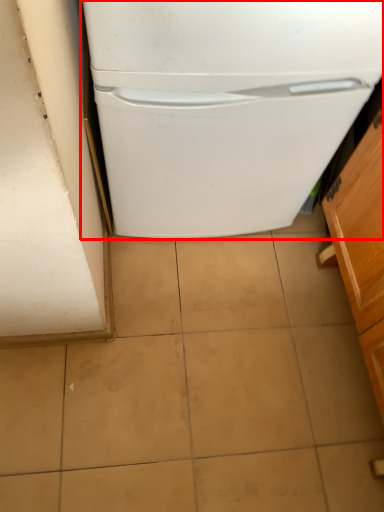
Question: Considering the relative positions of refrigerator (annotated by the red box) and cabinetry in the image provided, where is refrigerator (annotated by the red box) located with respect to the staircase?

Choices:
 (A) left
 (B) right

Answer: (A)